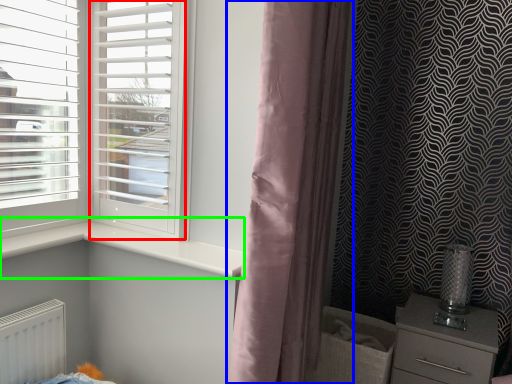
Question: Estimate the real-world distances between objects in this image. Which object is closer to screen door (highlighted by a red box), curtain (highlighted by a blue box) or window sill (highlighted by a green box)?

Choices:
 (A) curtain
 (B) window sill

Answer: (B)